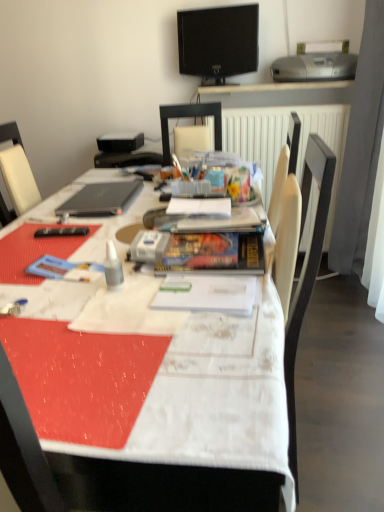
Image resolution: width=384 pixels, height=512 pixels. Find the location of `vacant space to the right of clear plastic bottle at center`. vacant space to the right of clear plastic bottle at center is located at coordinates (172, 286).